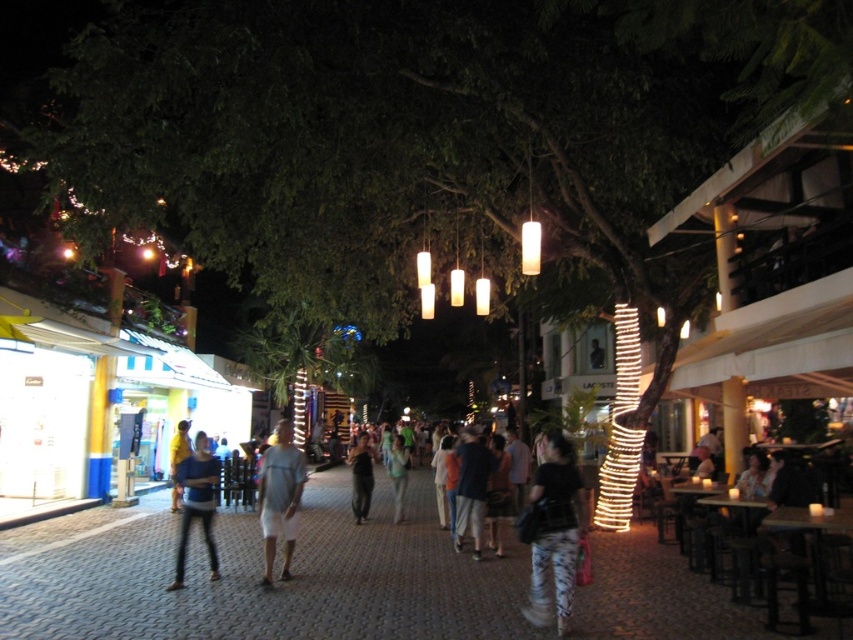
Can you confirm if matte blue shirt at center is positioned below dark brown leather jacket at center?

No.

Is matte blue shirt at center in front of dark brown leather jacket at center?

Yes.

Is point (207, 499) behind point (361, 456)?

That is False.

Where is `matte blue shirt at center`? This screenshot has width=853, height=640. matte blue shirt at center is located at coordinates (196, 502).

Can you confirm if green leafy tree at center is positioned above white cotton shorts at center?

Incorrect, green leafy tree at center is not positioned above white cotton shorts at center.

Which is below, green leafy tree at center or white cotton shorts at center?

green leafy tree at center is lower down.

Describe the element at coordinates (305, 355) in the screenshot. I see `green leafy tree at center` at that location.

This screenshot has height=640, width=853. I want to click on green leafy tree at center, so click(305, 355).

Is white cotton shorts at center thinner than dark blue shirt at center?

Yes.

Which is more to the left, white cotton shorts at center or dark blue shirt at center?

From the viewer's perspective, white cotton shorts at center appears more on the left side.

Is point (289, 513) closer to viewer compared to point (492, 461)?

Yes, it is in front of point (492, 461).

Locate an element on the screen. The image size is (853, 640). white cotton shorts at center is located at coordinates (279, 497).